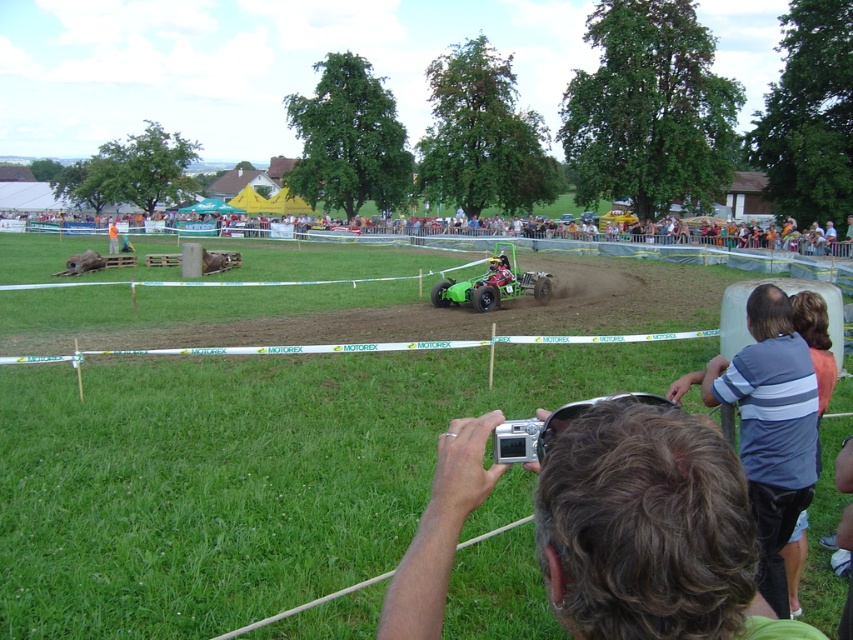
Question: Which of the following is the closest to the observer?

Choices:
 (A) (769, 580)
 (B) (347, 433)
 (C) (213, 232)

Answer: (A)

Question: Can you confirm if striped cotton shirt at lower right is positioned to the right of green matte race car at center?

Choices:
 (A) yes
 (B) no

Answer: (B)

Question: Is green rubber car at center below gray hair at lower center?

Choices:
 (A) no
 (B) yes

Answer: (A)

Question: Estimate the real-world distances between objects in this image. Which object is closer to the green rubber car at center?

Choices:
 (A) green plastic chairs at upper center
 (B) striped cotton shirt at lower right

Answer: (B)

Question: Which point is closer to the camera?

Choices:
 (A) green matte race car at center
 (B) green rubber car at center
 (C) striped cotton shirt at lower right
 (D) gray hair at lower center

Answer: (D)

Question: Can you confirm if striped cotton shirt at lower right is wider than green plastic chairs at upper center?

Choices:
 (A) no
 (B) yes

Answer: (A)